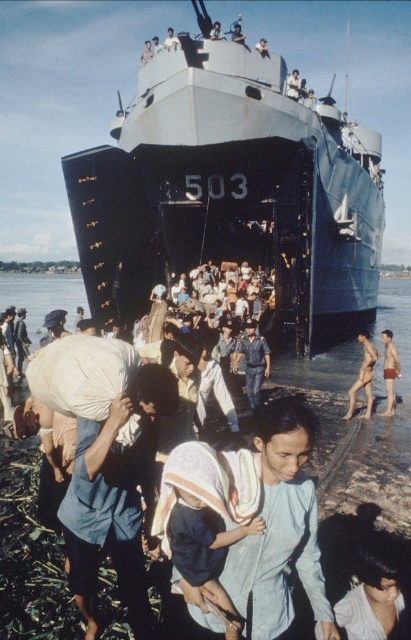
Question: Among these points, which one is nearest to the camera?

Choices:
 (A) (251, 384)
 (B) (94, 164)
 (C) (203, 554)

Answer: (C)

Question: Can you confirm if dark blue fabric at center is smaller than blue uniformed man at center?

Choices:
 (A) no
 (B) yes

Answer: (A)

Question: Which object appears closest to the camera in this image?

Choices:
 (A) blue matte ship at center
 (B) blue uniformed man at center
 (C) dark blue fabric at center

Answer: (C)

Question: Which of the following is the farthest from the observer?

Choices:
 (A) blue uniformed man at center
 (B) light brown fabric bag at lower left

Answer: (B)

Question: Does dark blue fabric at center have a lesser width compared to blue uniformed man at center?

Choices:
 (A) yes
 (B) no

Answer: (B)

Question: Can you confirm if blue matte ship at center is thinner than dark blue fabric at center?

Choices:
 (A) yes
 (B) no

Answer: (B)